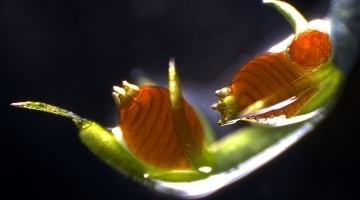
Find the location of a particular element. green plant is located at coordinates (118, 150), (296, 18), (317, 100).